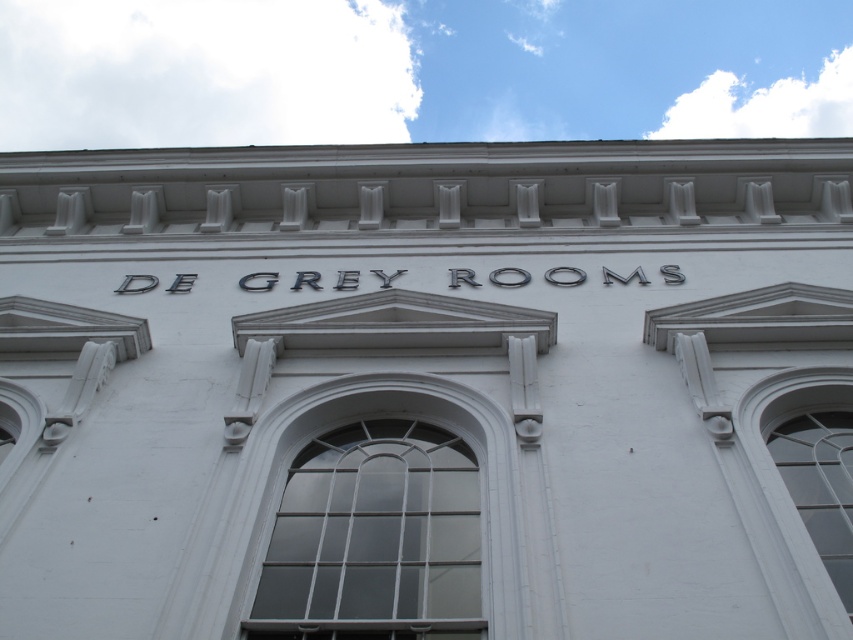
Question: In this image, where is clear glass window at center located relative to clear glass window at right?

Choices:
 (A) below
 (B) above

Answer: (A)

Question: Does clear glass window at center have a smaller size compared to clear glass window at right?

Choices:
 (A) no
 (B) yes

Answer: (B)

Question: Which object is farther from the camera taking this photo?

Choices:
 (A) clear glass window at right
 (B) clear glass window at center

Answer: (A)

Question: Is clear glass window at center positioned before clear glass window at right?

Choices:
 (A) yes
 (B) no

Answer: (A)

Question: Which of the following is the farthest from the observer?

Choices:
 (A) (825, 536)
 (B) (334, 484)

Answer: (B)